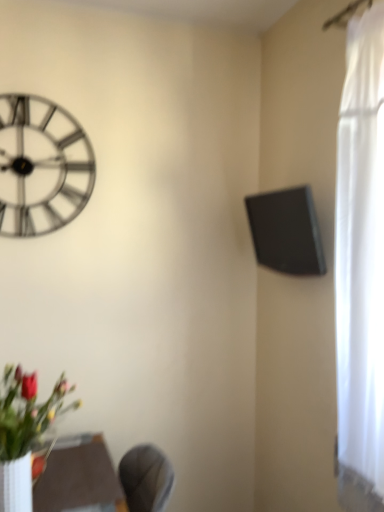
This screenshot has width=384, height=512. What do you see at coordinates (286, 231) in the screenshot?
I see `black matte speaker at upper right` at bounding box center [286, 231].

Measure the distance between matte brown table at lower center and camera.

They are 4.62 feet apart.

At what (x,y) coordinates should I click in order to perform the action: click on metallic silver clock at upper left. Please return your answer as a coordinate pair (x, y). This screenshot has width=384, height=512. Looking at the image, I should click on (41, 166).

From a real-world perspective, is metallic silver clock at upper left located beneath matte brown table at lower center?

Incorrect, from a real-world perspective, metallic silver clock at upper left is higher than matte brown table at lower center.

Which object is more forward, metallic silver clock at upper left or matte brown table at lower center?

matte brown table at lower center is in front.

Considering the relative sizes of metallic silver clock at upper left and matte brown table at lower center in the image provided, is metallic silver clock at upper left taller than matte brown table at lower center?

Correct, metallic silver clock at upper left is much taller as matte brown table at lower center.

Considering the sizes of objects metallic silver clock at upper left and matte brown table at lower center in the image provided, who is thinner, metallic silver clock at upper left or matte brown table at lower center?

Thinner between the two is metallic silver clock at upper left.

Considering the sizes of objects black matte speaker at upper right and matte brown table at lower center in the image provided, who is bigger, black matte speaker at upper right or matte brown table at lower center?

Bigger between the two is matte brown table at lower center.

Does black matte speaker at upper right have a lesser width compared to matte brown table at lower center?

Correct, the width of black matte speaker at upper right is less than that of matte brown table at lower center.

Is point (309, 199) closer or farther from the camera than point (39, 479)?

Point (309, 199) appears to be farther away from the viewer than point (39, 479).

From a real-world perspective, which is physically above, black matte speaker at upper right or matte brown table at lower center?

black matte speaker at upper right.

Between matte brown table at lower center and metallic silver clock at upper left, which one is positioned behind?

metallic silver clock at upper left.

Between matte brown table at lower center and metallic silver clock at upper left, which one appears on the right side from the viewer's perspective?

Positioned to the right is matte brown table at lower center.

Is point (101, 477) in front of point (58, 198)?

That is True.

Is matte brown table at lower center beside metallic silver clock at upper left?

There is a gap between matte brown table at lower center and metallic silver clock at upper left.

Does black matte speaker at upper right have a greater height compared to metallic silver clock at upper left?

In fact, black matte speaker at upper right may be shorter than metallic silver clock at upper left.

Is black matte speaker at upper right to the right of metallic silver clock at upper left from the viewer's perspective?

Yes, black matte speaker at upper right is to the right of metallic silver clock at upper left.

In the scene shown: Are black matte speaker at upper right and metallic silver clock at upper left beside each other?

There is a gap between black matte speaker at upper right and metallic silver clock at upper left.

Considering the positions of objects matte brown table at lower center and black matte speaker at upper right in the image provided, who is more to the right, matte brown table at lower center or black matte speaker at upper right?

black matte speaker at upper right.

Which object is wider, matte brown table at lower center or black matte speaker at upper right?

matte brown table at lower center.

What's the angular difference between matte brown table at lower center and black matte speaker at upper right's facing directions?

They differ by 0.859 degrees in their facing directions.

From the image's perspective, which one is positioned higher, matte brown table at lower center or black matte speaker at upper right?

From the image's view, black matte speaker at upper right is above.

Considering the sizes of objects metallic silver clock at upper left and black matte speaker at upper right in the image provided, who is bigger, metallic silver clock at upper left or black matte speaker at upper right?

With larger size is black matte speaker at upper right.

Considering the relative positions of metallic silver clock at upper left and black matte speaker at upper right in the image provided, is metallic silver clock at upper left to the right of black matte speaker at upper right from the viewer's perspective?

No.

The width and height of the screenshot is (384, 512). In order to click on wall clock above the black matte speaker at upper right (from the image's perspective) in this screenshot , I will do `click(41, 166)`.

From the image's perspective, which is below, metallic silver clock at upper left or black matte speaker at upper right?

From the image's view, black matte speaker at upper right is below.

Image resolution: width=384 pixels, height=512 pixels. Identify the location of round table lying on the right of metallic silver clock at upper left. (79, 477).

Locate an element on the screen. round table in front of the black matte speaker at upper right is located at coordinates (79, 477).

Considering their positions, is metallic silver clock at upper left positioned closer to black matte speaker at upper right than matte brown table at lower center?

metallic silver clock at upper left.

From the image, which object appears to be nearer to black matte speaker at upper right, matte brown table at lower center or metallic silver clock at upper left?

Among the two, metallic silver clock at upper left is located nearer to black matte speaker at upper right.

From the image, which object appears to be nearer to metallic silver clock at upper left, black matte speaker at upper right or matte brown table at lower center?

black matte speaker at upper right is positioned closer to the anchor metallic silver clock at upper left.

Considering their positions, is metallic silver clock at upper left positioned further to matte brown table at lower center than black matte speaker at upper right?

black matte speaker at upper right is positioned further to the anchor matte brown table at lower center.

From the image, which object appears to be farther from matte brown table at lower center, black matte speaker at upper right or metallic silver clock at upper left?

Based on the image, black matte speaker at upper right appears to be further to matte brown table at lower center.

Which object lies further to the anchor point metallic silver clock at upper left, matte brown table at lower center or black matte speaker at upper right?

matte brown table at lower center is positioned further to the anchor metallic silver clock at upper left.

Find the location of a particular element. This screenshot has height=512, width=384. window screen between metallic silver clock at upper left and matte brown table at lower center in the up-down direction is located at coordinates (286, 231).